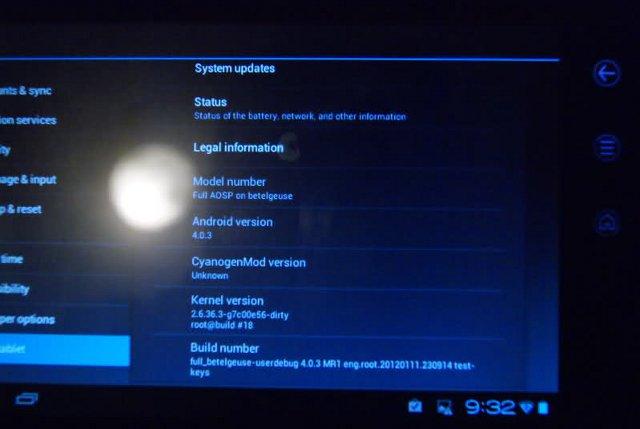
Locate an element on the screen. This screenshot has width=640, height=429. screen is located at coordinates (472, 148).